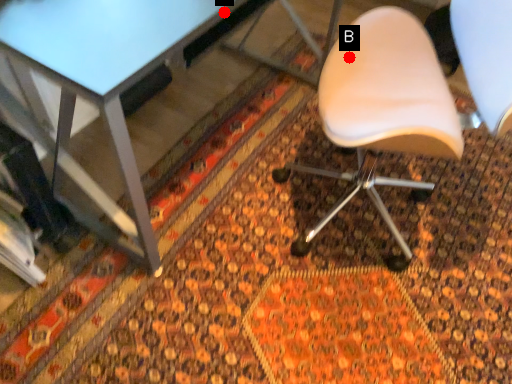
Question: Two points are circled on the image, labeled by A and B beside each circle. Which point appears closest to the camera in this image?

Choices:
 (A) A is closer
 (B) B is closer

Answer: (A)